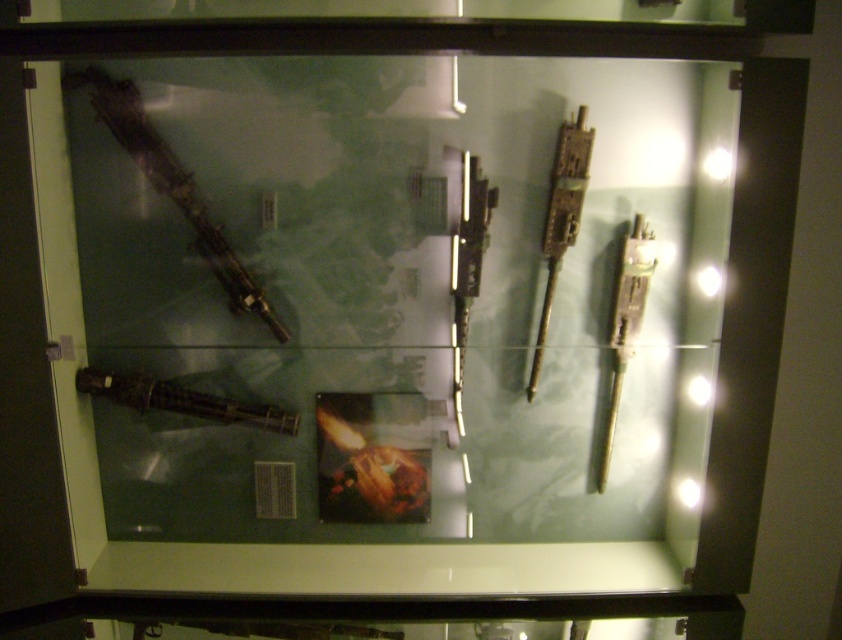
Measure the distance between matte black sword at lower left and green metallic sword at right.

matte black sword at lower left is 30.77 inches away from green metallic sword at right.

Between matte black sword at lower left and green metallic sword at right, which one is positioned lower?

matte black sword at lower left

Between point (150, 403) and point (640, 284), which one is positioned in front?

Point (640, 284) is in front.

At what (x,y) coordinates should I click in order to perform the action: click on matte black sword at lower left. Please return your answer as a coordinate pair (x, y). This screenshot has width=842, height=640. Looking at the image, I should click on (180, 401).

Looking at this image, is metallic silver gun at center behind matte black sword at lower left?

No, it is not.

Which is above, metallic silver gun at center or matte black sword at lower left?

metallic silver gun at center is above.

Who is more forward, (461, 253) or (125, 401)?

Point (461, 253) is more forward.

Find the location of a particular element. This screenshot has height=640, width=842. metallic silver gun at center is located at coordinates coord(465,246).

Looking at this image, does rusty metal gun at upper right have a lesser width compared to green metallic sword at right?

No, rusty metal gun at upper right is not thinner than green metallic sword at right.

What do you see at coordinates (561, 218) in the screenshot?
I see `rusty metal gun at upper right` at bounding box center [561, 218].

The image size is (842, 640). Identify the location of rusty metal gun at upper right. (561, 218).

The height and width of the screenshot is (640, 842). Identify the location of rusty metal gun at upper right. (561, 218).